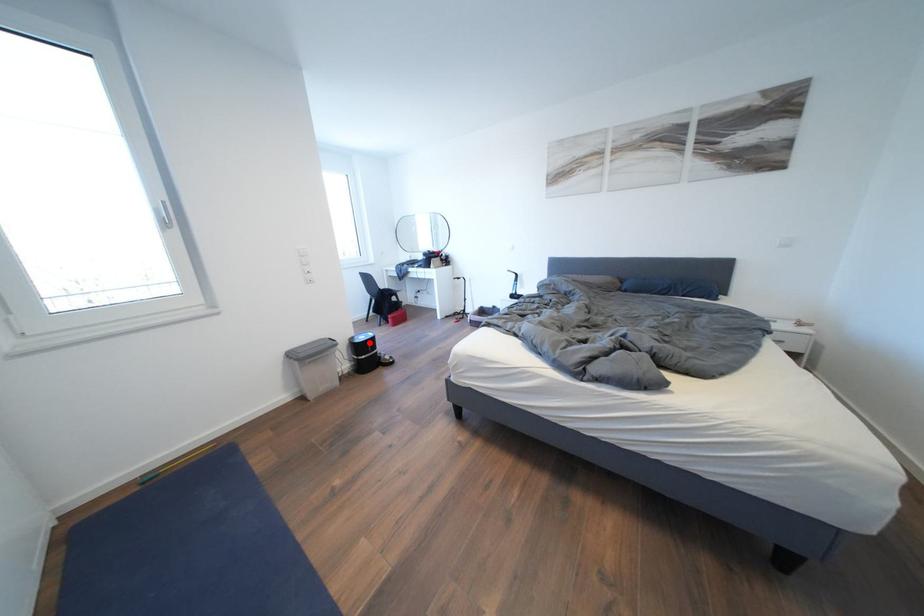
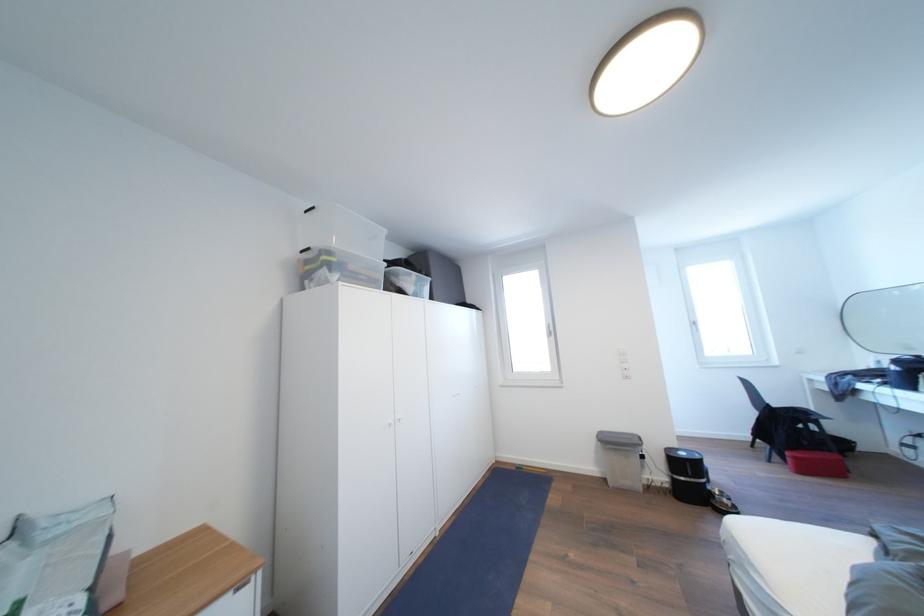
Question: I am providing you with two images of the same scene from different viewpoints. In image1, a red point is highlighted. Considering the same 3D point in image2, which of the following is correct?

Choices:
 (A) It is closer
 (B) It is farther

Answer: (B)